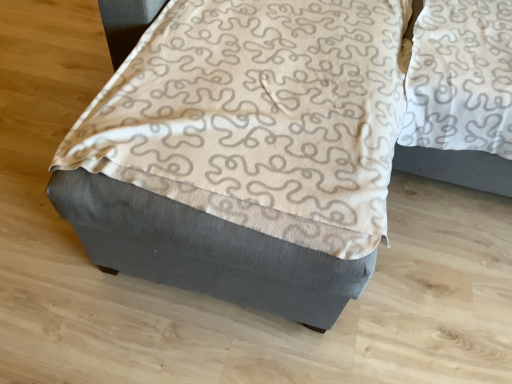
Where is `beige textured blanket at upper right`? beige textured blanket at upper right is located at coordinates (460, 77).

The height and width of the screenshot is (384, 512). Describe the element at coordinates (460, 77) in the screenshot. I see `beige textured blanket at upper right` at that location.

The width and height of the screenshot is (512, 384). Identify the location of beige textured blanket at upper right. (460, 77).